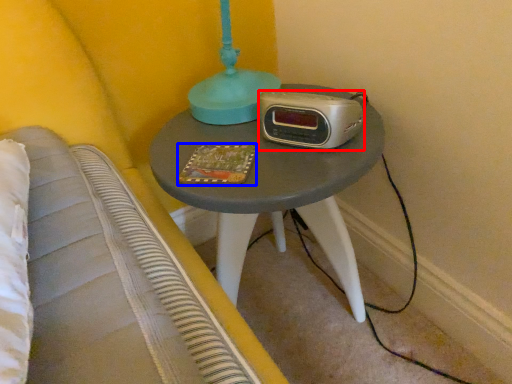
Question: Which of the following is the closest to the observer, stereo (highlighted by a red box) or book (highlighted by a blue box)?

Choices:
 (A) stereo
 (B) book

Answer: (A)